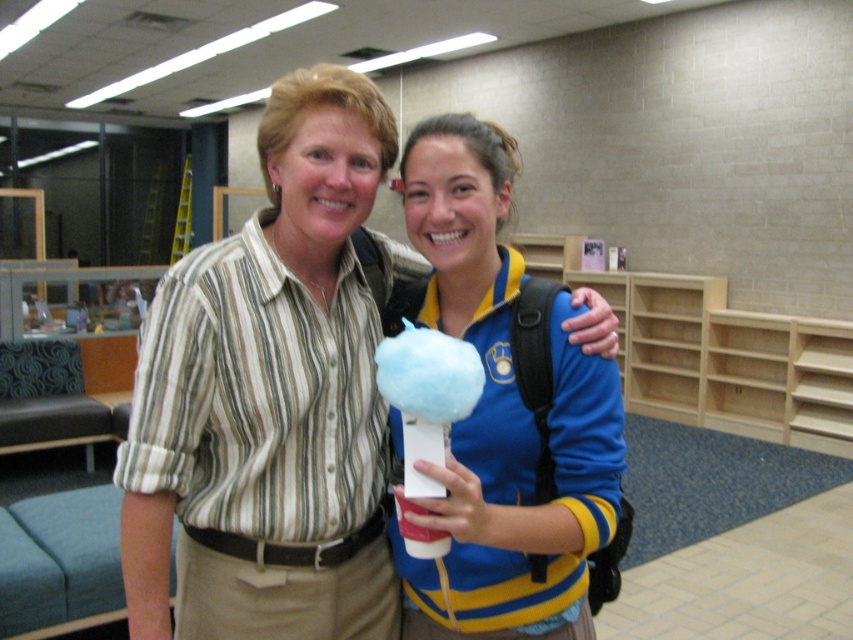
Does blue cotton candy at center have a larger size compared to matte blue cotton candy at center?

Yes, blue cotton candy at center is bigger than matte blue cotton candy at center.

Is point (254, 216) closer to viewer compared to point (596, 358)?

No, (254, 216) is further to viewer.

What do you see at coordinates (271, 396) in the screenshot?
I see `blue cotton candy at center` at bounding box center [271, 396].

Locate an element on the screen. This screenshot has height=640, width=853. blue cotton candy at center is located at coordinates (271, 396).